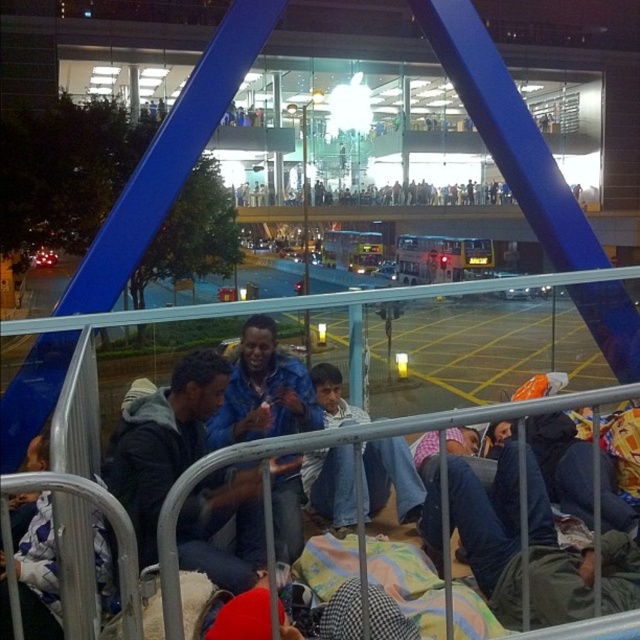
Question: Which point appears farthest from the camera in this image?

Choices:
 (A) (172, 538)
 (B) (289, 540)
 (C) (336, 392)
 (D) (22, 627)

Answer: (C)

Question: Which object appears closest to the camera in this image?

Choices:
 (A) blue denim jacket at center
 (B) blue matte jacket at center

Answer: (A)

Question: Is denim jacket at lower right above jeans at center?

Choices:
 (A) no
 (B) yes

Answer: (A)

Question: Does blue denim jacket at center have a greater width compared to jeans at center?

Choices:
 (A) yes
 (B) no

Answer: (A)

Question: Which object is farther from the camera taking this photo?

Choices:
 (A) blue denim jacket at center
 (B) metallic gray rail at lower center
 (C) denim jacket at lower right

Answer: (A)

Question: Is blue denim jacket at center to the right of jeans at center from the viewer's perspective?

Choices:
 (A) yes
 (B) no

Answer: (B)